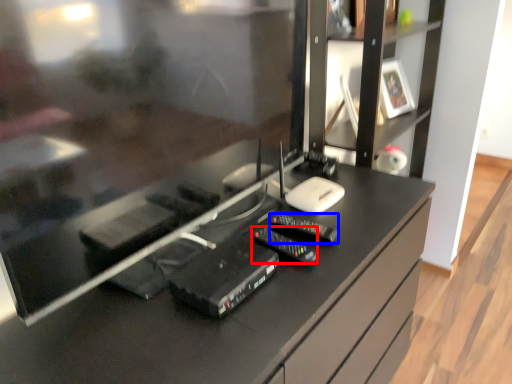
Question: Among these objects, which one is farthest to the camera, equipment (highlighted by a red box) or control (highlighted by a blue box)?

Choices:
 (A) equipment
 (B) control

Answer: (B)